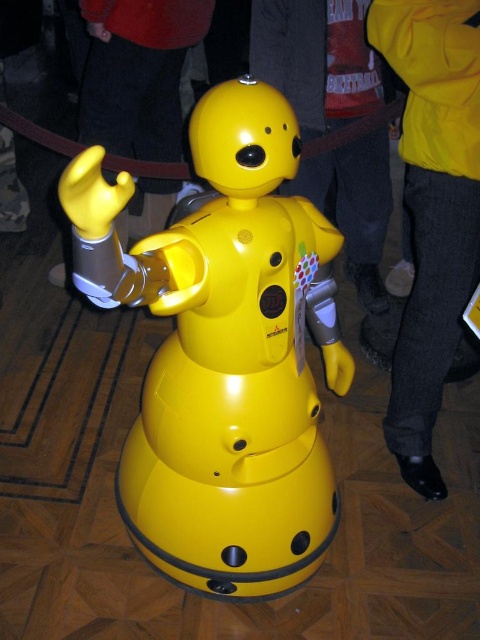
Question: Which of the following is the farthest from the observer?

Choices:
 (A) [285, 205]
 (B) [404, 16]
 (C) [302, 116]
 (D) [155, 97]

Answer: (D)

Question: Is yellow fabric pants at lower right above yellow matte robot at center?

Choices:
 (A) yes
 (B) no

Answer: (B)

Question: Considering the real-world distances, which object is closest to the matte plastic robot at center?

Choices:
 (A) yellow fabric pants at lower right
 (B) yellow matte robot at center
 (C) matte yellow robot at center

Answer: (A)

Question: Where is yellow fabric pants at lower right located in relation to matte yellow robot at center in the image?

Choices:
 (A) left
 (B) right

Answer: (B)

Question: Does yellow fabric pants at lower right lie in front of yellow matte robot at center?

Choices:
 (A) yes
 (B) no

Answer: (A)

Question: Which point is closer to the camera taking this photo?

Choices:
 (A) (402, 16)
 (B) (302, 88)

Answer: (A)